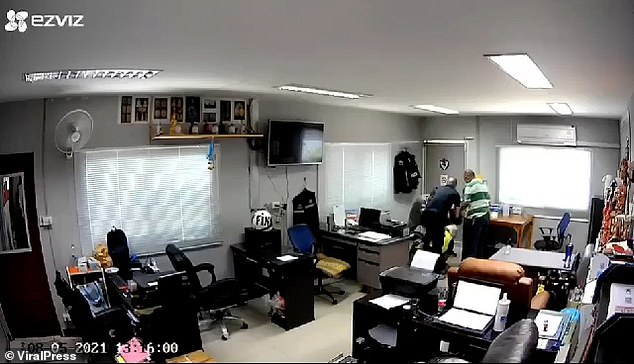
Identify the location of fan. (77, 133).